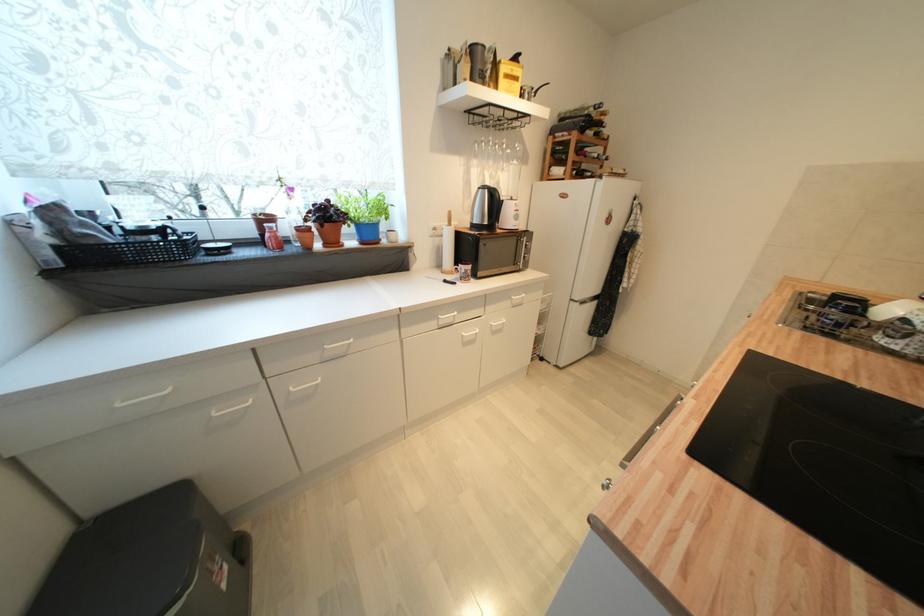
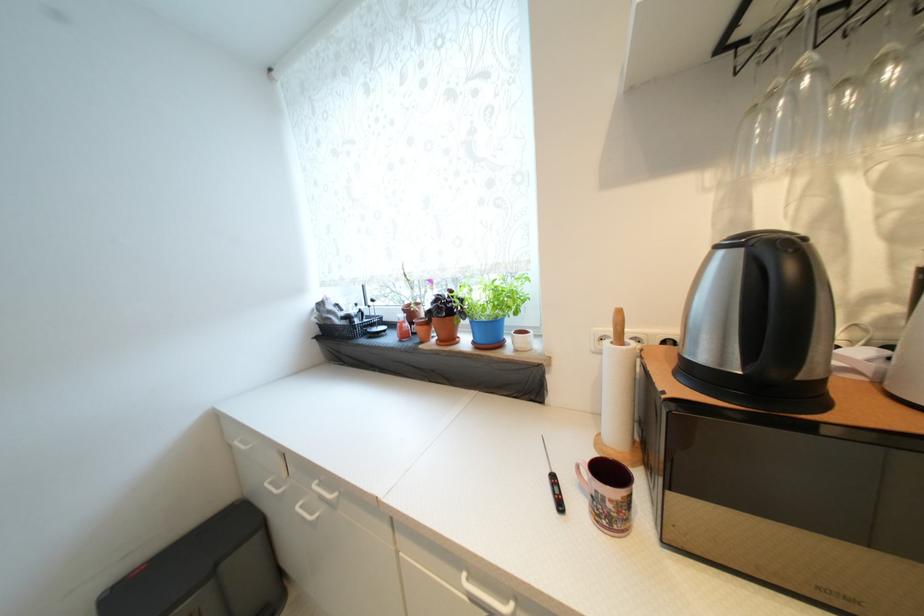
Question: The camera is either moving clockwise (left) or counter-clockwise (right) around the object. The first image is from the beginning of the video and the second image is from the end. Is the camera moving left or right when shooting the video?

Choices:
 (A) Left
 (B) Right

Answer: (B)